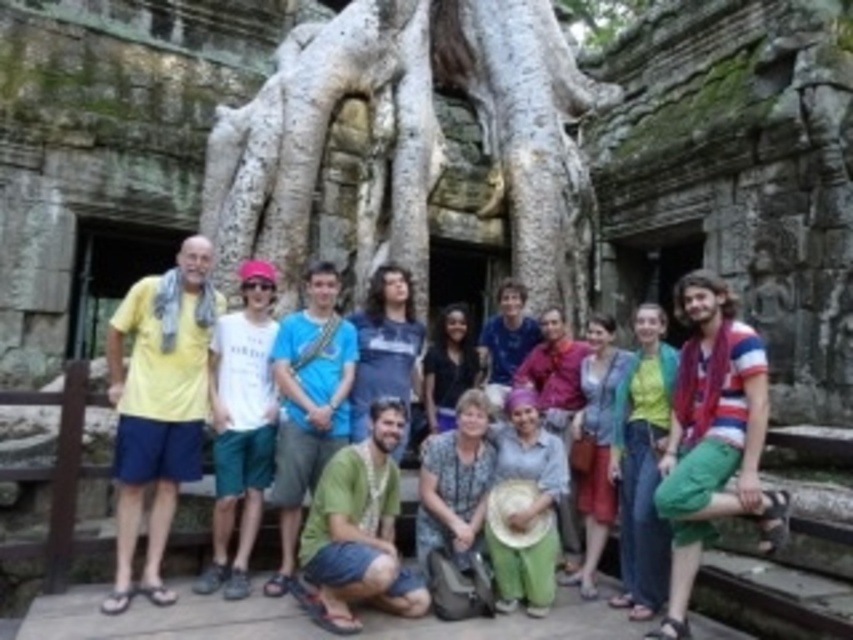
You are a photographer trying to frame a shot that includes both the green denim jeans at center and the light brown woven hat at lower center. Which object should you adjust your camera angle to focus on first if you want to ensure both fit in the frame without cropping either?

You should focus on the green denim jeans at center first because it is wider than the light brown woven hat at lower center, so ensuring its full inclusion will naturally accommodate the smaller object within the frame.

You are a photographer trying to capture a clear shot of the floral fabric dress at center without any obstructions. Considering the white textured roots at center, is there a way to position yourself so that the roots are not blocking the dress?

The white textured roots at center are above the floral fabric dress at center, so positioning yourself lower or moving the dress slightly downward could allow you to capture the dress without the roots obstructing it.